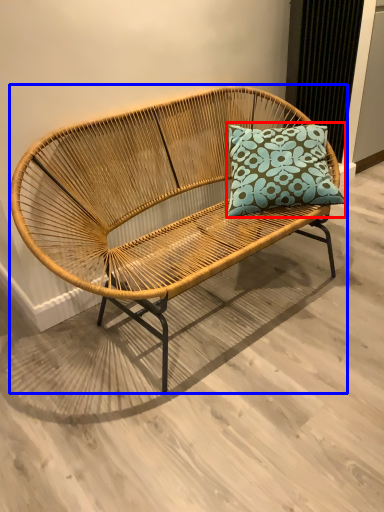
Question: Among these objects, which one is nearest to the camera, pillow (highlighted by a red box) or studio couch (highlighted by a blue box)?

Choices:
 (A) pillow
 (B) studio couch

Answer: (B)